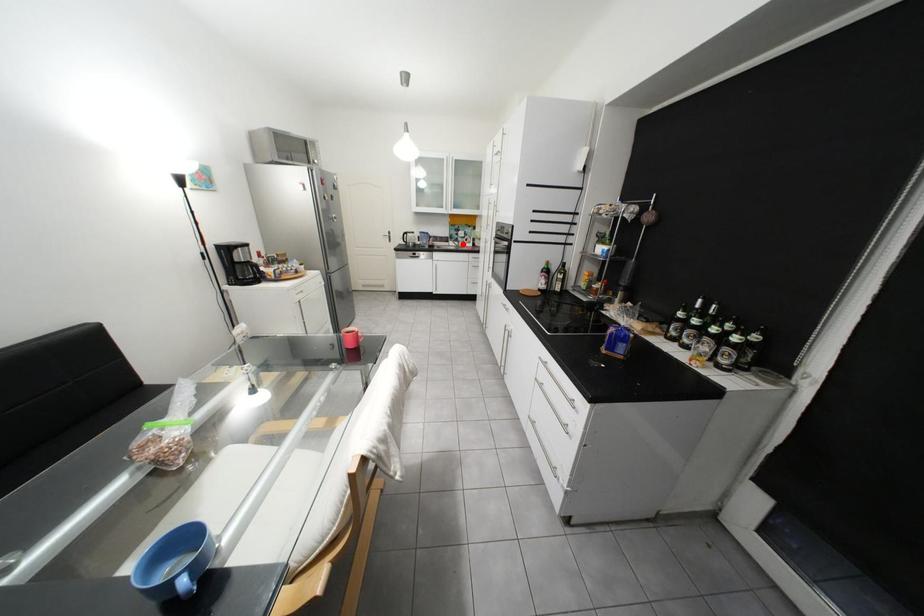
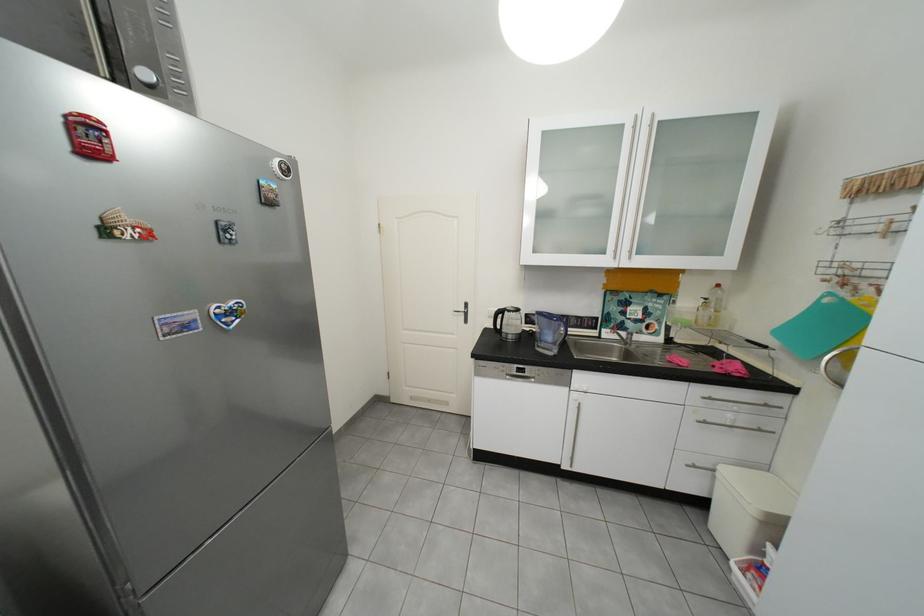
Where in the second image is the point corresponding to the highlighted location from the first image?

(619, 334)